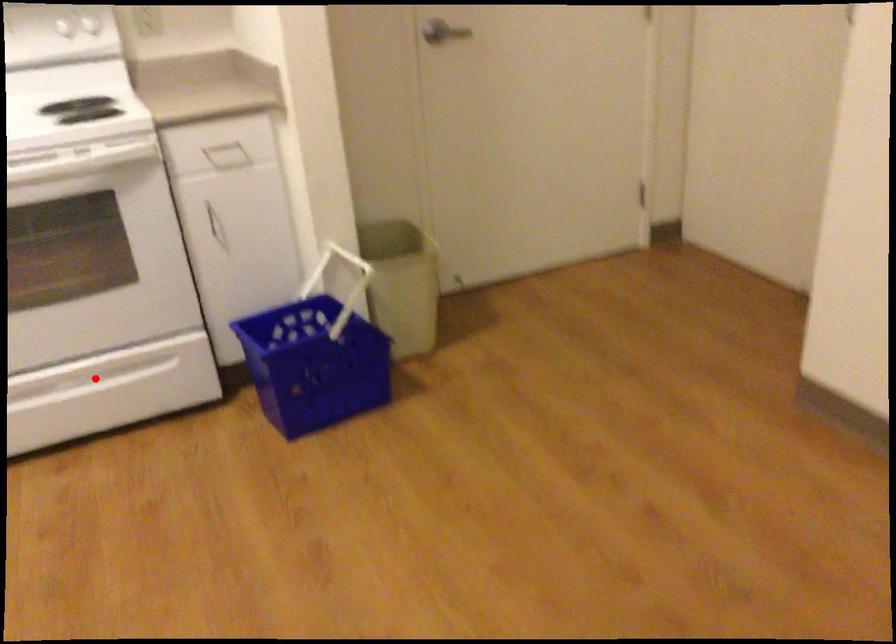
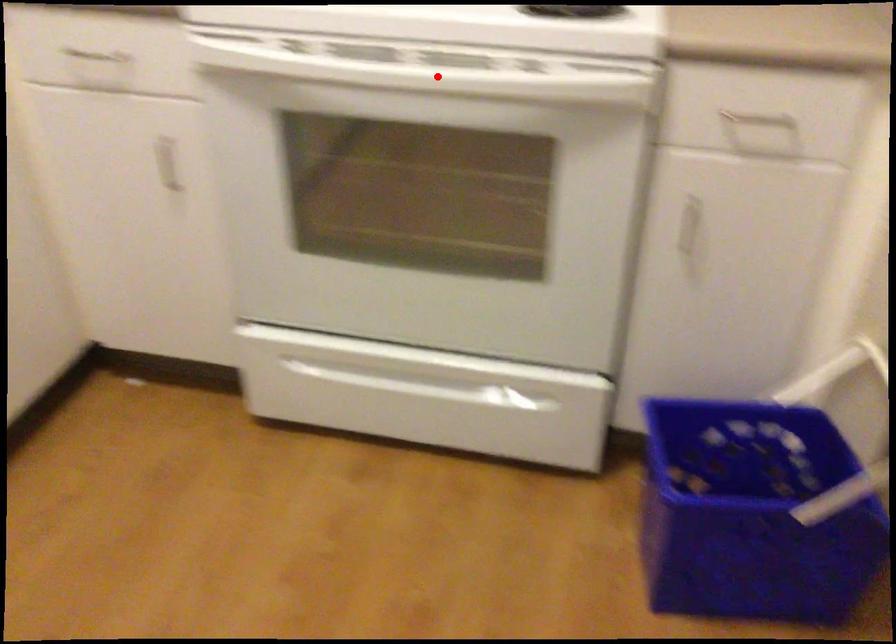
I am providing you with two images of the same scene from different viewpoints. A red point is marked on the first image and another point is marked on the second image. Does the point marked in image1 correspond to the same location as the one in image2?

No